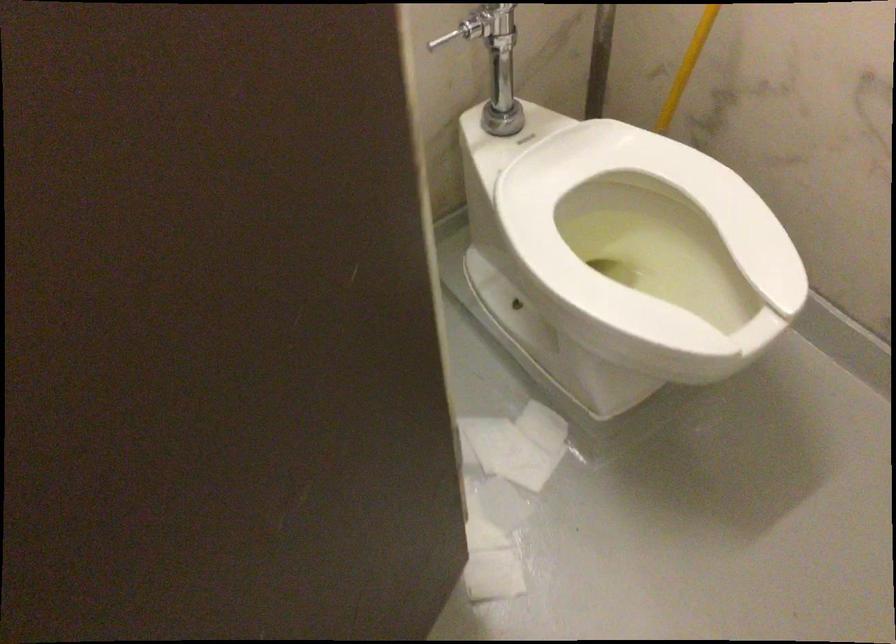
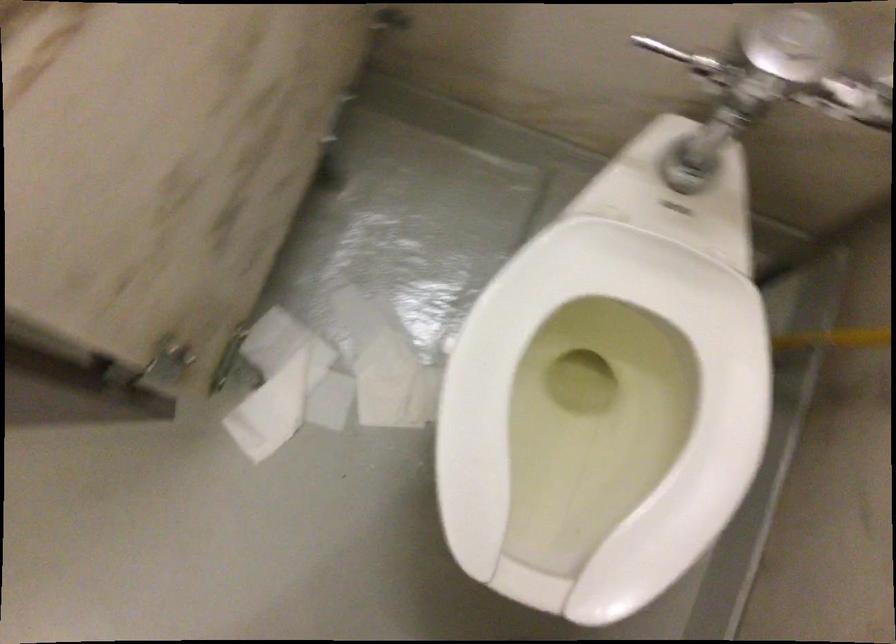
Find the pixel in the second image that matches (647,274) in the first image.

(600, 415)